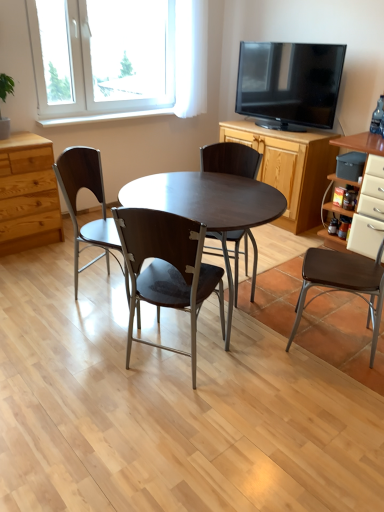
Where is `vacant space to the left of matte brown chair at center, marked as the 2th chair in a left-to-right arrangement`? The image size is (384, 512). vacant space to the left of matte brown chair at center, marked as the 2th chair in a left-to-right arrangement is located at coordinates (93, 359).